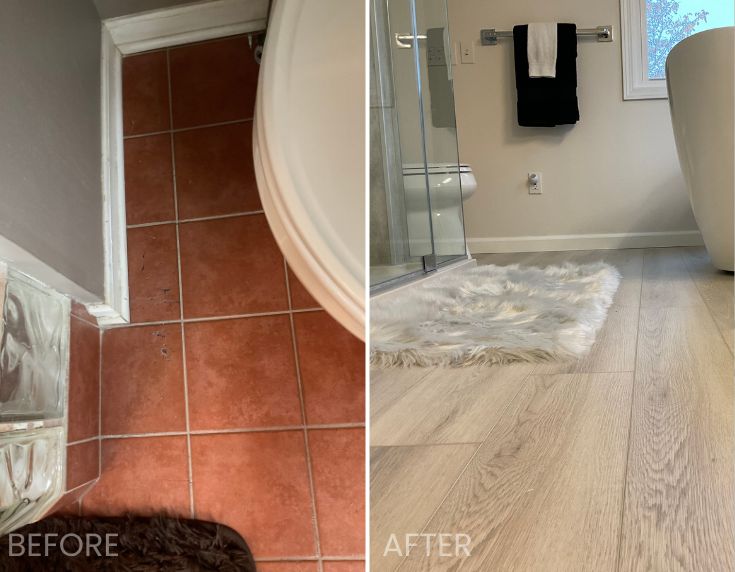
This screenshot has width=735, height=572. Find the location of `towel rod`. towel rod is located at coordinates (598, 27).